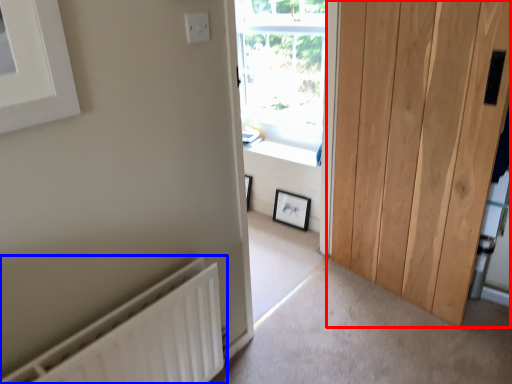
Question: Which of the following is the farthest to the observer, door (highlighted by a red box) or radiator (highlighted by a blue box)?

Choices:
 (A) door
 (B) radiator

Answer: (A)